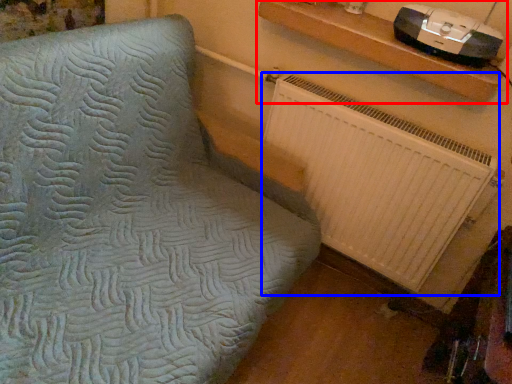
Question: Among these objects, which one is nearest to the camera, shelf (highlighted by a red box) or radiator (highlighted by a blue box)?

Choices:
 (A) shelf
 (B) radiator

Answer: (A)